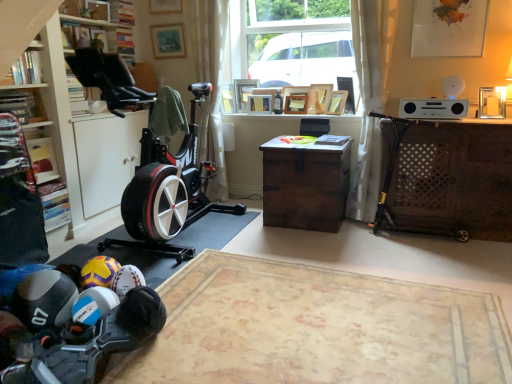
Image resolution: width=512 pixels, height=384 pixels. What are the coordinates of `spots to the right of rubberized black dumbbells at lower left` in the screenshot? It's located at (201, 351).